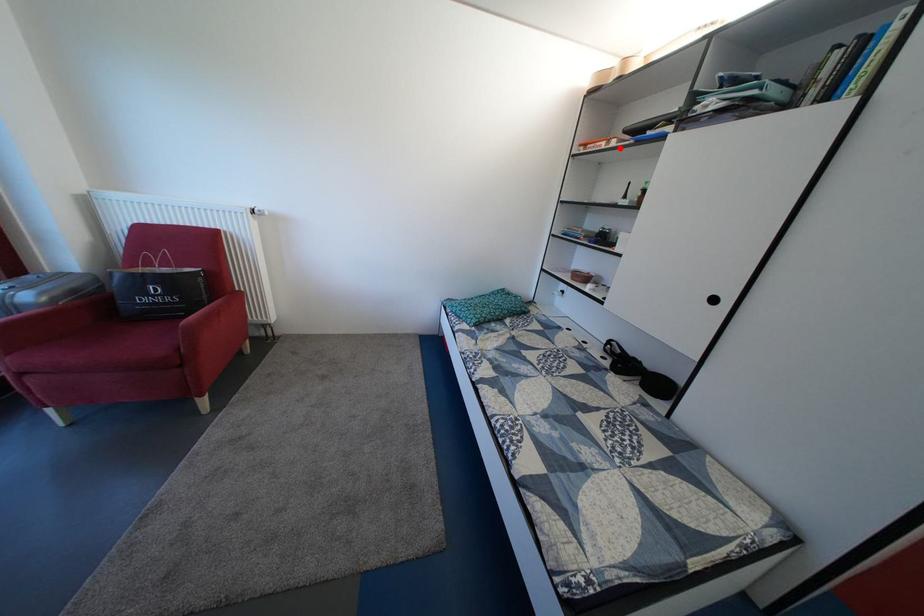
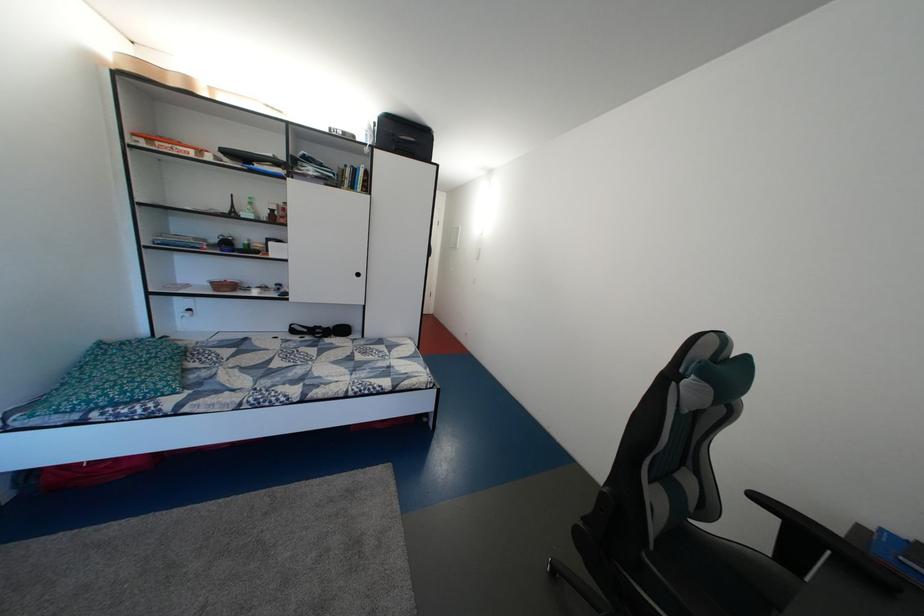
Question: I am providing you with two images of the same scene from different viewpoints. A red point is marked on the first image. At the location where the point appears in image 1, is it still visible in image 2?

Choices:
 (A) Yes
 (B) No

Answer: (A)